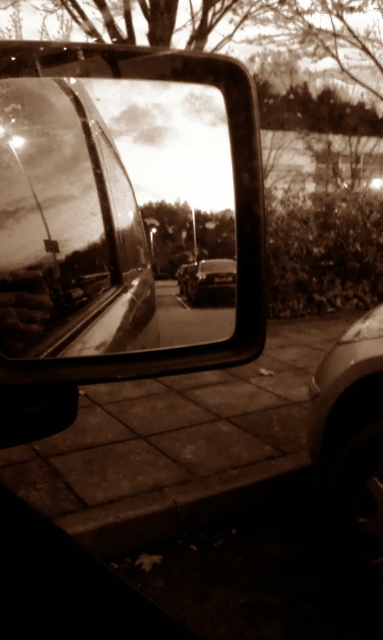
You are a photographer trying to capture both the metallic car mirror at upper left and the shiny black tire at lower right in a single frame. Based on their positions, which object should you adjust your camera to focus on first to ensure both are in the shot?

Since the metallic car mirror at upper left is to the left of shiny black tire at lower right, you should focus on the metallic car mirror at upper left first to ensure both are included in the frame.

You are driving a car and want to change lanes. You look at the shiny silver car at center in your side mirror and notice the shiny black tire at lower right. Based on their positions, is there enough space to safely move into the adjacent lane?

The shiny silver car at center is behind the shiny black tire at lower right, meaning the distance between them may be insufficient for a safe lane change. Wait until there is more space before attempting to change lanes.

You are driving a car and want to check your blind spot. You notice the metallic car mirror at upper left and the shiny silver car at center. Which object is positioned higher relative to the other?

The metallic car mirror at upper left is located above the shiny silver car at center, meaning it is positioned higher.